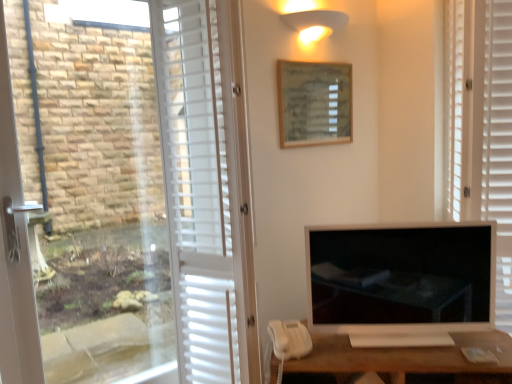
Question: Based on their sizes in the image, would you say white matte desk at lower right is bigger or smaller than white matte blind at right?

Choices:
 (A) small
 (B) big

Answer: (A)

Question: From a real-world perspective, is white matte desk at lower right physically located above or below white matte blind at right?

Choices:
 (A) below
 (B) above

Answer: (A)

Question: Based on their relative distances, which object is farther from the white matte corded phone at lower center?

Choices:
 (A) white matte desk at lower right
 (B) white matte blind at right
 (C) warm matte wall sconce at upper center
 (D) wooden frame at upper center
 (E) matte black monitor at center

Answer: (C)

Question: Estimate the real-world distances between objects in this image. Which object is closer to the white matte desk at lower right?

Choices:
 (A) warm matte wall sconce at upper center
 (B) white matte screen door at left
 (C) matte black monitor at center
 (D) white matte blind at right
 (E) wooden frame at upper center

Answer: (C)